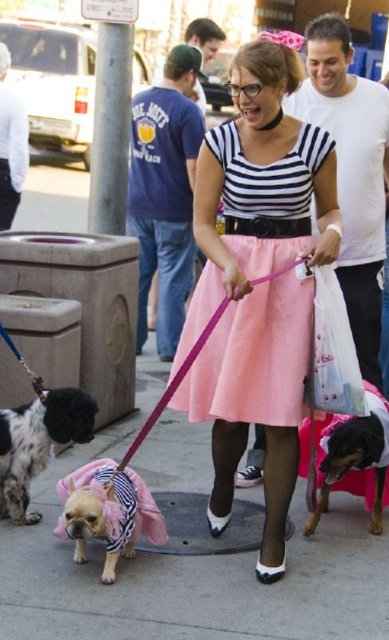
You are a delivery person carrying a package that needs to be placed on the ground. You see the black and tan dog at center and the translucent plastic bag at center. Which object is closer to you so you can place the package safely?

The black and tan dog at center is closer to you than the translucent plastic bag at center, so place the package away from the dog to avoid tripping it.

You are a delivery person who needs to carry a large package. You see a spotted fur dog at lower left and a translucent plastic bag at center. Which object can you use to help carry your package?

The spotted fur dog at lower left is larger in size than the translucent plastic bag at center, so the spotted fur dog at lower left can be used to help carry the package.

You are a photographer trying to capture the spotted fur dog at lower left and the black and tan dog at center in a single frame. Which dog should you focus on to ensure both are visible without zooming in too much?

The spotted fur dog at lower left occupies less space than the black and tan dog at center, so focusing on the larger black and tan dog at center will help keep both in frame without excessive zoom.